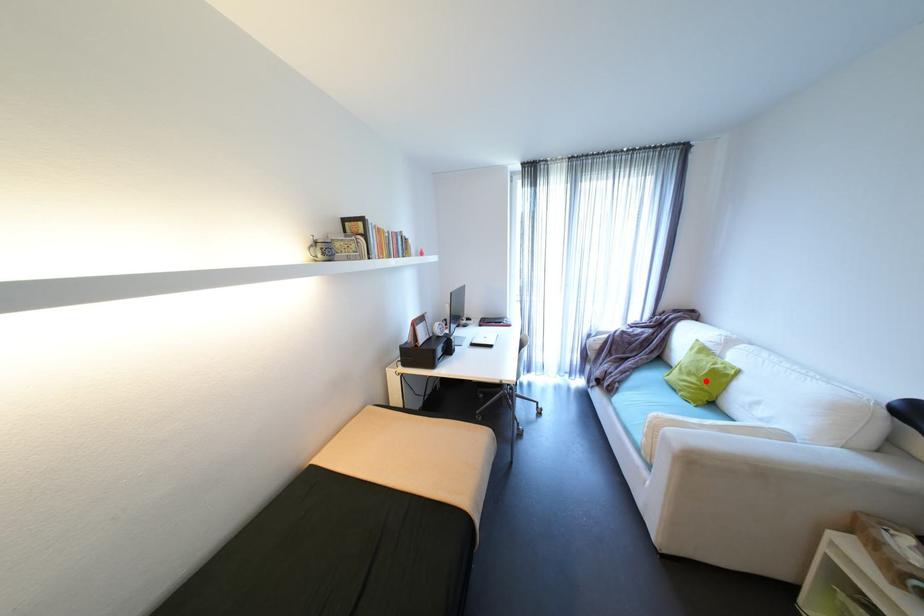
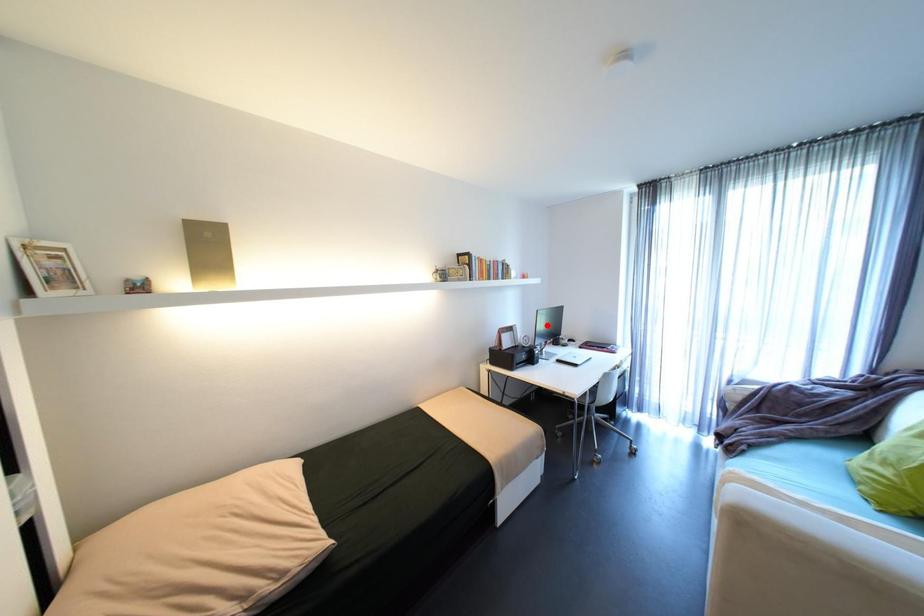
I am providing you with two images of the same scene from different viewpoints. A red point is marked on the first image and another point is marked on the second image. Do the highlighted points in image1 and image2 indicate the same real-world spot?

No